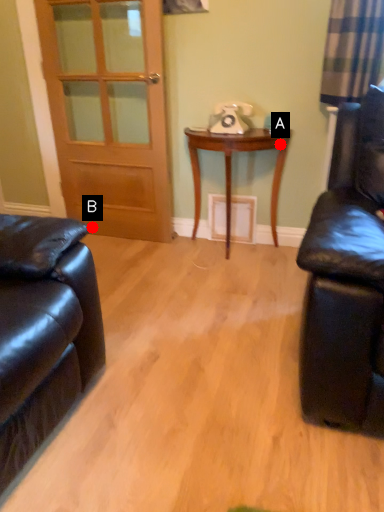
Question: Two points are circled on the image, labeled by A and B beside each circle. Which point is farther to the camera?

Choices:
 (A) A is further
 (B) B is further

Answer: (B)